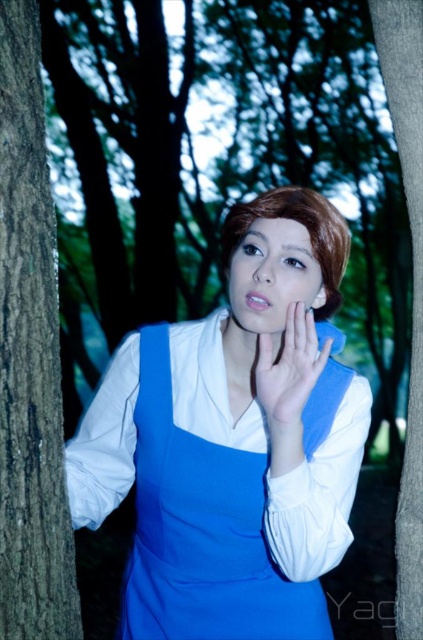
Between point (398, 593) and point (269, 202), which one is positioned in front?

Point (269, 202) is in front.

Is smooth brown tree trunk at center closer to camera compared to smooth brown hair at center?

No, smooth brown tree trunk at center is further to the viewer.

Locate an element on the screen. The width and height of the screenshot is (423, 640). smooth brown tree trunk at center is located at coordinates (412, 282).

Between blue fabric dress at center and smooth brown bark at left, which one appears on the right side from the viewer's perspective?

Positioned to the right is blue fabric dress at center.

Is blue fabric dress at center smaller than smooth brown bark at left?

Actually, blue fabric dress at center might be larger than smooth brown bark at left.

Locate an element on the screen. blue fabric dress at center is located at coordinates (233, 440).

Is point (8, 100) closer to camera compared to point (288, 442)?

Yes, point (8, 100) is in front of point (288, 442).

Describe the element at coordinates (30, 356) in the screenshot. This screenshot has width=423, height=640. I see `smooth brown bark at left` at that location.

What do you see at coordinates (30, 356) in the screenshot? I see `smooth brown bark at left` at bounding box center [30, 356].

In order to click on smooth brown bark at left in this screenshot , I will do `click(30, 356)`.